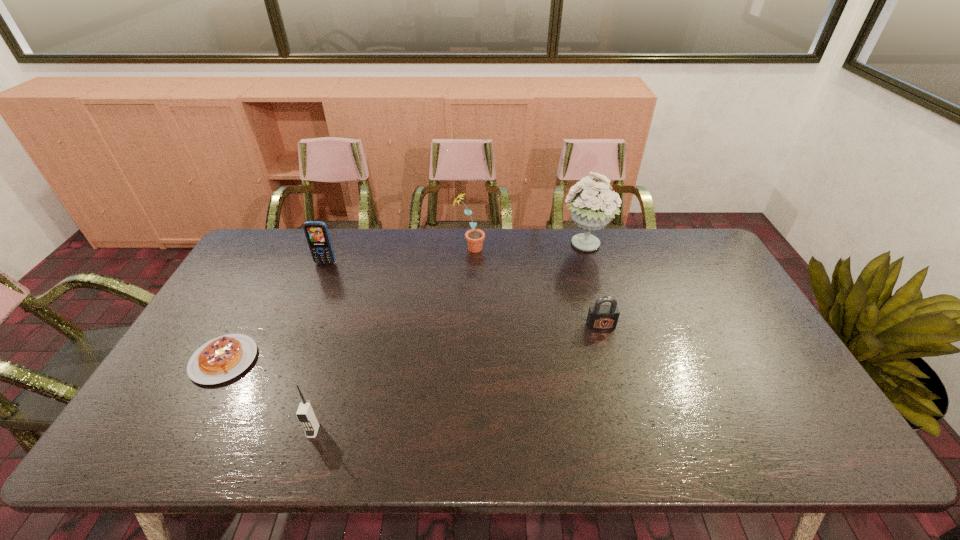
This screenshot has height=540, width=960. Identify the location of the leftmost object. (223, 358).

Identify the location of free space located on the left of the bouquet. The width and height of the screenshot is (960, 540). (484, 246).

Identify the location of vacant space located on the flower of the sunflower. This screenshot has height=540, width=960. (576, 248).

Locate an element on the screen. Image resolution: width=960 pixels, height=540 pixels. free spot located 0.060m on the screen of the fifth object from right to left is located at coordinates (320, 277).

What are the coordinates of `vacant space located on the front of the second shortest object near the keyhole` in the screenshot? It's located at (610, 356).

Identify the location of vacant space located on the back of the pancake. (262, 291).

Locate an element on the screen. The height and width of the screenshot is (540, 960). bouquet that is at the far edge is located at coordinates (591, 209).

Identify the location of sunflower located at the far edge. (474, 237).

At what (x,y) coordinates should I click in order to perform the action: click on cellular telephone at the far edge. Please return your answer as a coordinate pair (x, y). The width and height of the screenshot is (960, 540). Looking at the image, I should click on (317, 235).

Locate an element on the screen. Image resolution: width=960 pixels, height=540 pixels. object that is at the near edge is located at coordinates (306, 414).